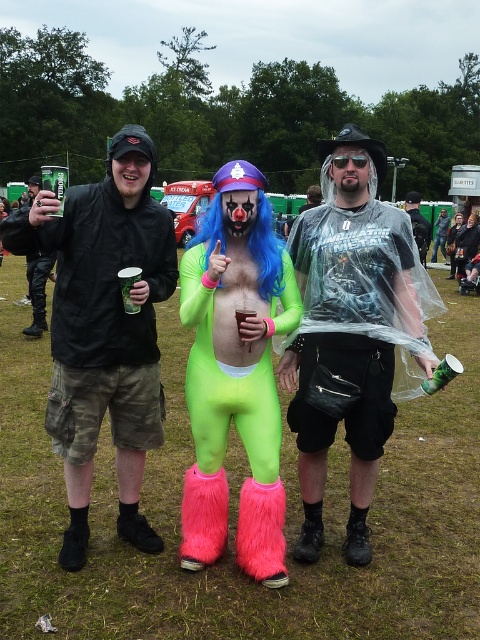
The height and width of the screenshot is (640, 480). I want to click on clear plastic poncho at center, so click(x=350, y=332).

Where is `clear plastic poncho at center`? The width and height of the screenshot is (480, 640). clear plastic poncho at center is located at coordinates (350, 332).

Which of these two, clear plastic poncho at center or neon green spandex suit at center, stands taller?

With more height is clear plastic poncho at center.

Based on the photo, does clear plastic poncho at center have a lesser width compared to neon green spandex suit at center?

No.

Find the location of a particular element. This screenshot has width=480, height=640. clear plastic poncho at center is located at coordinates (350, 332).

Image resolution: width=480 pixels, height=640 pixels. What do you see at coordinates (418, 225) in the screenshot? I see `clear plastic bag at center` at bounding box center [418, 225].

Looking at this image, is clear plastic bag at center taller than green plastic cup at center?

Yes, clear plastic bag at center is taller than green plastic cup at center.

Which is in front, point (411, 227) or point (122, 296)?

Point (122, 296) is in front.

The image size is (480, 640). I want to click on clear plastic bag at center, so click(x=418, y=225).